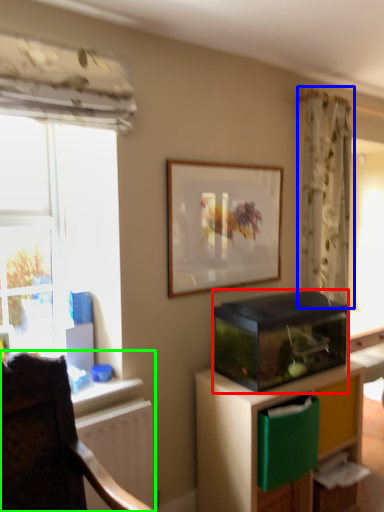
Question: Based on their relative distances, which object is nearer to appliance (highlighted by a red box)? Choose from curtain (highlighted by a blue box) and chair (highlighted by a green box).

Choices:
 (A) curtain
 (B) chair

Answer: (A)